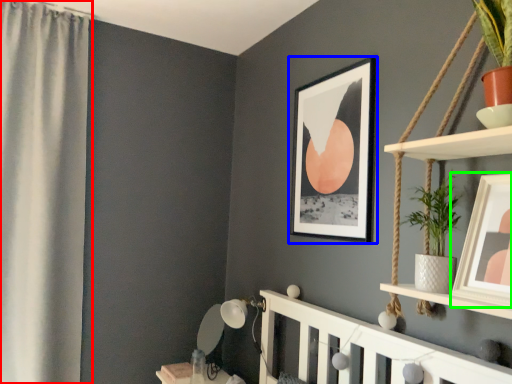
Question: Which object is positioned closest to curtain (highlighted by a red box)? Select from picture frame (highlighted by a blue box) and picture frame (highlighted by a green box).

Choices:
 (A) picture frame
 (B) picture frame

Answer: (A)